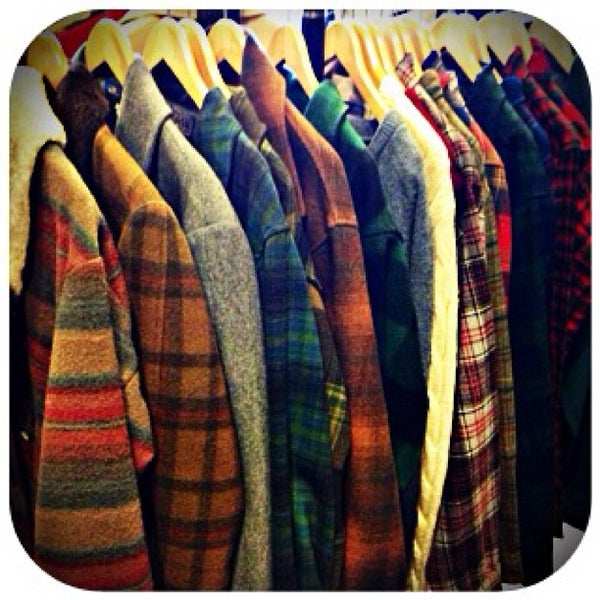
Locate an element on the screen. cloth hanger is located at coordinates (288, 52).